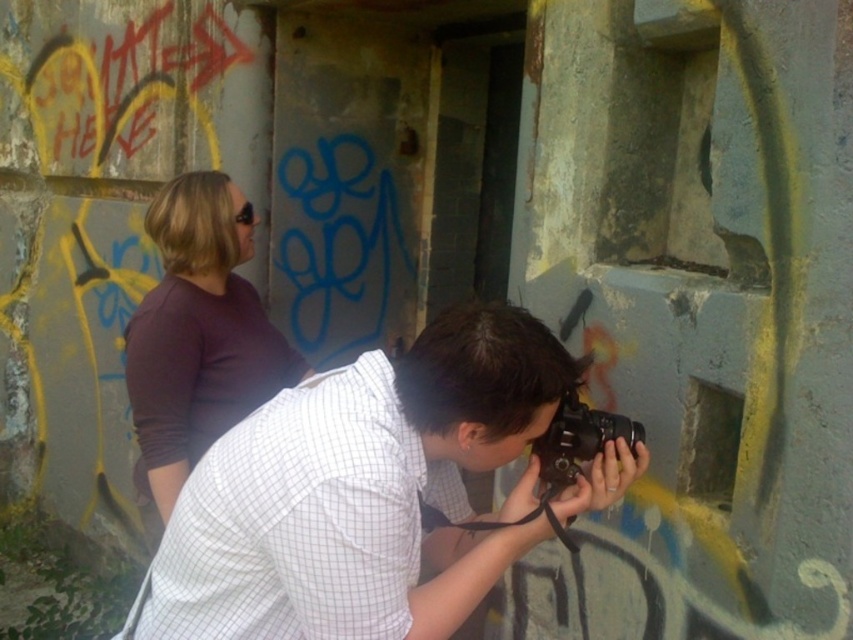
You are standing in the abandoned building and want to take a photo of the graffiti. You have two points marked as reference points. Which point is closer to you, point (451, 358) or point (606, 412)?

Point (451, 358) is closer to the camera than point (606, 412).

You are a photographer trying to capture the matte purple shirt at upper left in the image. The camera is positioned at point A, which is located at coordinates [198,333]. Can you determine if the matte purple shirt at upper left is within the camera frame?

The point [198,333] indicates the location of the matte purple shirt at upper left, so yes, the camera positioned at that point would capture the matte purple shirt at upper left within its frame.

You are standing at point (282, 392) and want to walk to the person on the right. Can you reach them without crossing the 1.27 meters distance?

Yes, since the distance between you and the person on the right is 1.27 meters, you can reach them without crossing that distance.